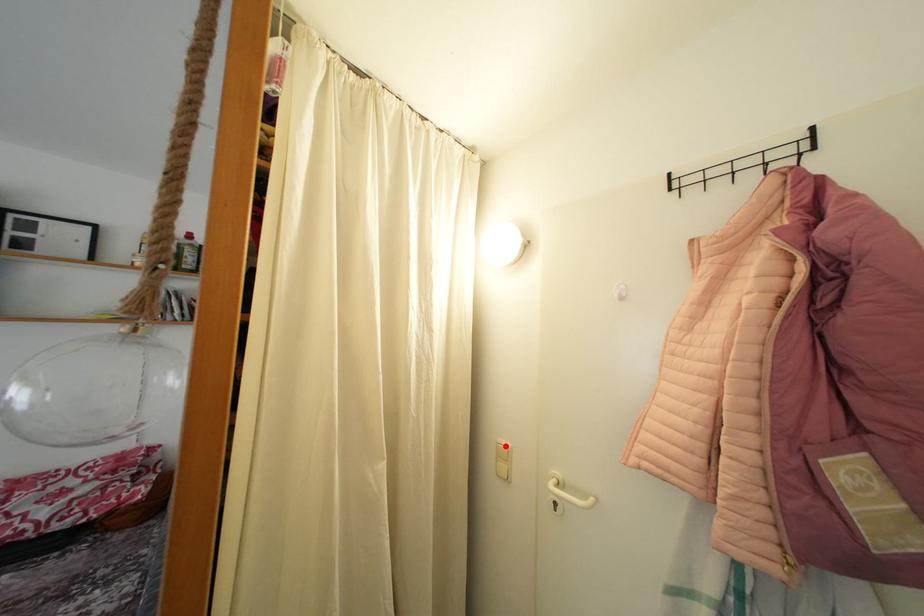
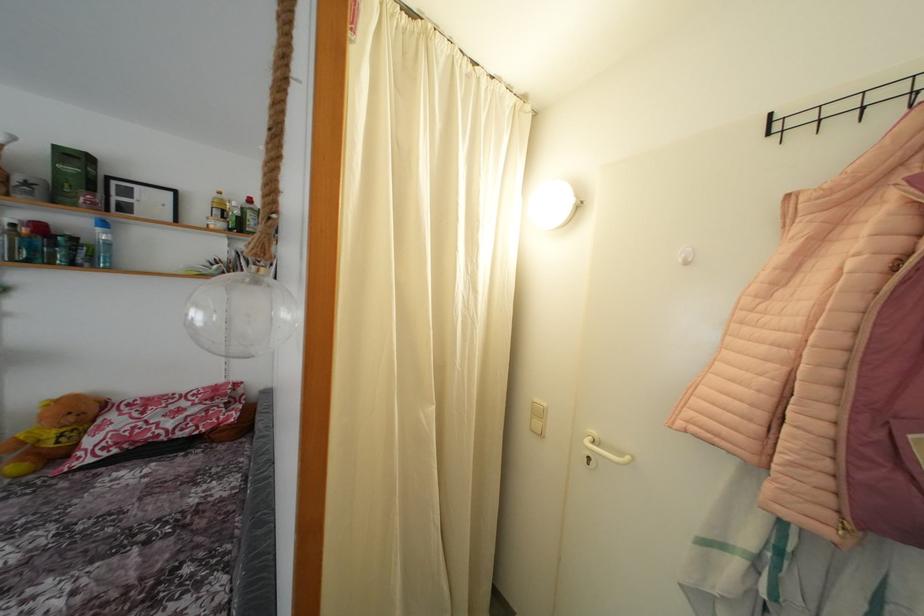
Question: A red point is marked in image1. In image2, is the corresponding 3D point closer to the camera or farther? Reply with the corresponding letter.

Choices:
 (A) The corresponding 3D point is closer.
 (B) The corresponding 3D point is farther.

Answer: (A)